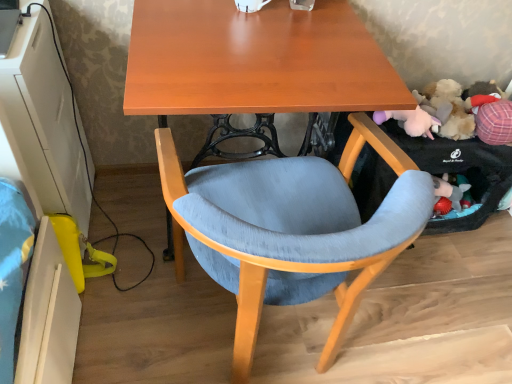
The image size is (512, 384). Identify the location of free point below textured fabric chair at center (from a real-world perspective). (259, 342).